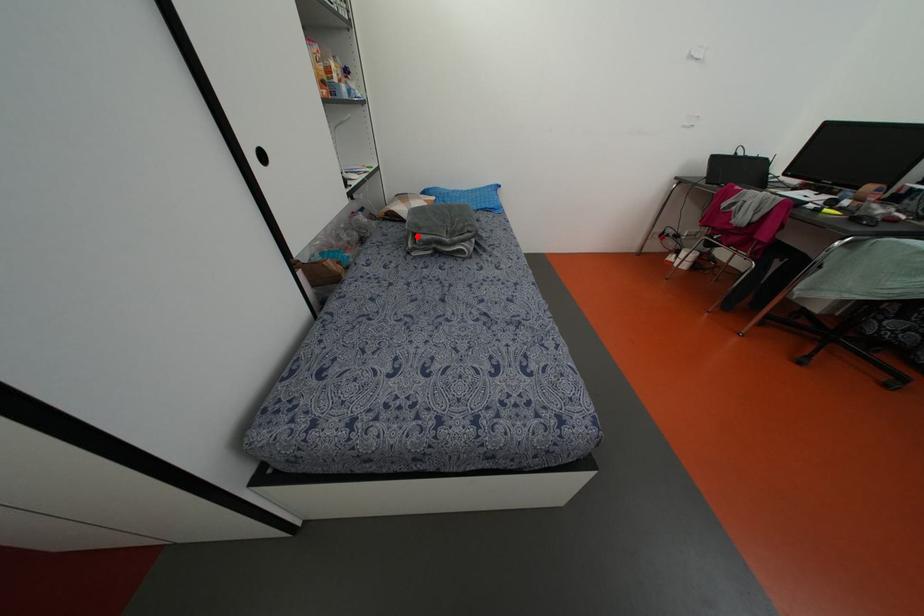
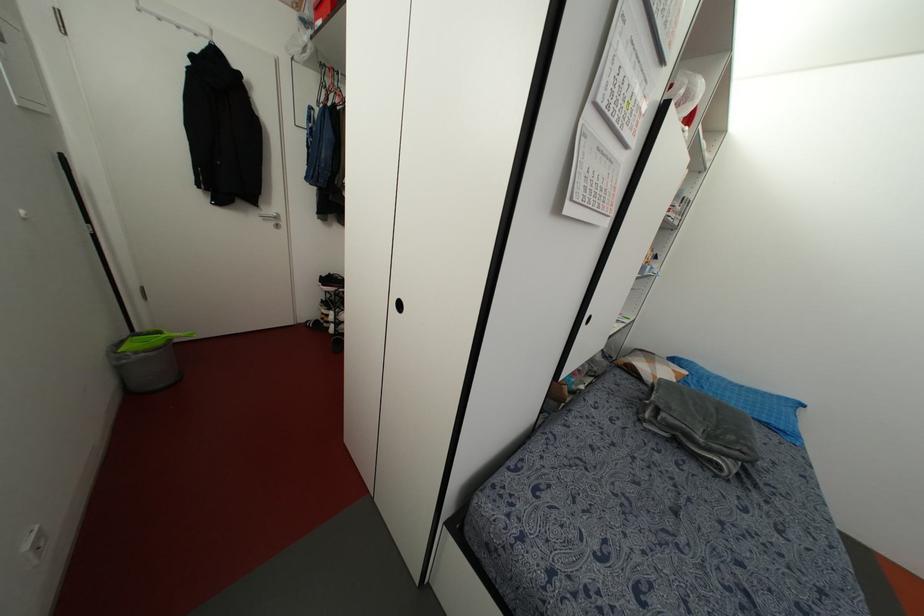
Locate, in the second image, the point that corresponds to the highlighted location in the first image.

(663, 415)